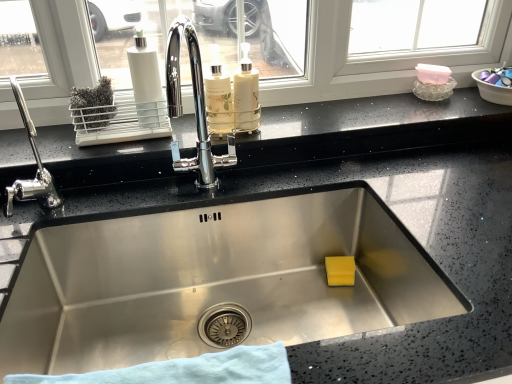
Locate an element on the screen. Image resolution: width=512 pixels, height=384 pixels. translucent glass bottle at center, arranged as the 1th bottle when viewed from the left is located at coordinates (218, 97).

Describe the element at coordinates (218, 97) in the screenshot. This screenshot has height=384, width=512. I see `translucent glass bottle at center, arranged as the 1th bottle when viewed from the left` at that location.

Identify the location of white matte bottle at center, positioned as the second bottle in left-to-right order. The image size is (512, 384). (246, 94).

Identify the location of blue cloth at bottom. pos(187,370).

Does white matte bottle at center, which is the 1th bottle from right to left, have a lesser height compared to translucent glass bottle at center, arranged as the 1th bottle when viewed from the left?

Incorrect, the height of white matte bottle at center, which is the 1th bottle from right to left, does not fall short of that of translucent glass bottle at center, arranged as the 1th bottle when viewed from the left.

Find the location of a particular element. The width and height of the screenshot is (512, 384). bottle lying on the left of white matte bottle at center, positioned as the second bottle in left-to-right order is located at coordinates (218, 97).

Is there a large distance between white matte bottle at center, positioned as the second bottle in left-to-right order, and translucent glass bottle at center, arranged as the 1th bottle when viewed from the left?

No.

Is chrome metallic faucet at left positioned far away from translucent glass bottle at center, arranged as the 1th bottle when viewed from the left?

No, chrome metallic faucet at left is not far away from translucent glass bottle at center, arranged as the 1th bottle when viewed from the left.

From a real-world perspective, is chrome metallic faucet at left over translucent glass bottle at center, arranged as the 1th bottle when viewed from the left?

No, from a real-world perspective, chrome metallic faucet at left is not on top of translucent glass bottle at center, arranged as the 1th bottle when viewed from the left.

Could you tell me if chrome metallic faucet at left is turned towards translucent glass bottle at center, positioned as the second bottle in right-to-left order?

No, chrome metallic faucet at left is not aimed at translucent glass bottle at center, positioned as the second bottle in right-to-left order.

Consider the image. Is chrome metallic faucet at left in front of or behind translucent glass bottle at center, positioned as the second bottle in right-to-left order, in the image?

chrome metallic faucet at left is positioned closer to the viewer than translucent glass bottle at center, positioned as the second bottle in right-to-left order.

Between translucent glass bottle at center, positioned as the second bottle in right-to-left order, and blue cloth at bottom, which one has smaller width?

With smaller width is translucent glass bottle at center, positioned as the second bottle in right-to-left order.

Between point (231, 120) and point (156, 363), which one is positioned behind?

Point (231, 120)

Where is `bath towel below the translucent glass bottle at center, positioned as the second bottle in right-to-left order (from a real-world perspective)`? bath towel below the translucent glass bottle at center, positioned as the second bottle in right-to-left order (from a real-world perspective) is located at coordinates (187, 370).

Is translucent glass bottle at center, arranged as the 1th bottle when viewed from the left, at the left side of blue cloth at bottom?

No.

Is chrome metallic faucet at left at the right side of white matte bottle at center, which is the 1th bottle from right to left?

No.

Looking at their sizes, would you say chrome metallic faucet at left is wider or thinner than white matte bottle at center, which is the 1th bottle from right to left?

Clearly, chrome metallic faucet at left has more width compared to white matte bottle at center, which is the 1th bottle from right to left.

Considering the sizes of objects chrome metallic faucet at left and white matte bottle at center, which is the 1th bottle from right to left, in the image provided, who is shorter, chrome metallic faucet at left or white matte bottle at center, which is the 1th bottle from right to left,?

With less height is white matte bottle at center, which is the 1th bottle from right to left.

From a real-world perspective, which is physically above, chrome metallic faucet at left or white matte bottle at center, which is the 1th bottle from right to left?

white matte bottle at center, which is the 1th bottle from right to left, is physically above.

In terms of width, does blue cloth at bottom look wider or thinner when compared to white matte bottle at center, which is the 1th bottle from right to left?

Considering their sizes, blue cloth at bottom looks broader than white matte bottle at center, which is the 1th bottle from right to left.

Does blue cloth at bottom have a greater height compared to white matte bottle at center, which is the 1th bottle from right to left?

No, blue cloth at bottom is not taller than white matte bottle at center, which is the 1th bottle from right to left.

From a real-world perspective, is blue cloth at bottom located beneath white matte bottle at center, which is the 1th bottle from right to left?

Correct, in the physical world, blue cloth at bottom is lower than white matte bottle at center, which is the 1th bottle from right to left.

How different are the orientations of blue cloth at bottom and white matte bottle at center, which is the 1th bottle from right to left, in degrees?

2.19 degrees.

Considering the relative positions of white matte bottle at center, which is the 1th bottle from right to left, and chrome metallic faucet at left in the image provided, is white matte bottle at center, which is the 1th bottle from right to left, behind chrome metallic faucet at left?

Yes, it is.

From the image's perspective, is white matte bottle at center, which is the 1th bottle from right to left, above chrome metallic faucet at left?

Correct, white matte bottle at center, which is the 1th bottle from right to left, appears higher than chrome metallic faucet at left in the image.

Find the location of a particular element. This screenshot has height=384, width=512. bottle that is the 2nd object to the right of the chrome metallic faucet at left, starting at the anchor is located at coordinates (246, 94).

From the picture: Is white matte bottle at center, positioned as the second bottle in left-to-right order, smaller than chrome metallic faucet at left?

Indeed, white matte bottle at center, positioned as the second bottle in left-to-right order, has a smaller size compared to chrome metallic faucet at left.

From a real-world perspective, which is physically above, blue cloth at bottom or translucent glass bottle at center, arranged as the 1th bottle when viewed from the left?

translucent glass bottle at center, arranged as the 1th bottle when viewed from the left, is physically above.

Find the location of `bath towel below the translucent glass bottle at center, arranged as the 1th bottle when viewed from the left (from a real-world perspective)`. bath towel below the translucent glass bottle at center, arranged as the 1th bottle when viewed from the left (from a real-world perspective) is located at coordinates (187, 370).

In terms of width, does blue cloth at bottom look wider or thinner when compared to translucent glass bottle at center, positioned as the second bottle in right-to-left order?

Clearly, blue cloth at bottom has more width compared to translucent glass bottle at center, positioned as the second bottle in right-to-left order.

You are a GUI agent. You are given a task and a screenshot of the screen. Output one action in this format:
    pyautogui.click(x=<x>, y=<y>)
    Task: Click on the bottle above the translucent glass bottle at center, arranged as the 1th bottle when viewed from the left (from the image's perspective)
    
    Given the screenshot: What is the action you would take?
    pyautogui.click(x=246, y=94)

At what (x,y) coordinates should I click in order to perform the action: click on tap located below the translucent glass bottle at center, arranged as the 1th bottle when viewed from the left (from the image's perspective). Please return your answer as a coordinate pair (x, y). This screenshot has width=512, height=384. Looking at the image, I should click on (37, 166).

Based on their spatial positions, is blue cloth at bottom or chrome metallic faucet at left further from white matte bottle at center, which is the 1th bottle from right to left?

Among the two, blue cloth at bottom is located further to white matte bottle at center, which is the 1th bottle from right to left.

Considering their positions, is translucent glass bottle at center, positioned as the second bottle in right-to-left order, positioned further to white matte bottle at center, which is the 1th bottle from right to left, than chrome metallic faucet at left?

Among the two, chrome metallic faucet at left is located further to white matte bottle at center, which is the 1th bottle from right to left.

Estimate the real-world distances between objects in this image. Which object is further from chrome metallic faucet at left, blue cloth at bottom or white matte bottle at center, positioned as the second bottle in left-to-right order?

white matte bottle at center, positioned as the second bottle in left-to-right order.

When comparing their distances from chrome metallic faucet at left, does blue cloth at bottom or translucent glass bottle at center, positioned as the second bottle in right-to-left order, seem further?

blue cloth at bottom lies further to chrome metallic faucet at left than the other object.

Which object lies nearer to the anchor point translucent glass bottle at center, positioned as the second bottle in right-to-left order, white matte bottle at center, positioned as the second bottle in left-to-right order, or blue cloth at bottom?

white matte bottle at center, positioned as the second bottle in left-to-right order, is positioned closer to the anchor translucent glass bottle at center, positioned as the second bottle in right-to-left order.

From the image, which object appears to be nearer to blue cloth at bottom, translucent glass bottle at center, arranged as the 1th bottle when viewed from the left, or white matte bottle at center, which is the 1th bottle from right to left?

Among the two, translucent glass bottle at center, arranged as the 1th bottle when viewed from the left, is located nearer to blue cloth at bottom.

From the image, which object appears to be farther from blue cloth at bottom, white matte bottle at center, which is the 1th bottle from right to left, or translucent glass bottle at center, arranged as the 1th bottle when viewed from the left?

Based on the image, white matte bottle at center, which is the 1th bottle from right to left, appears to be further to blue cloth at bottom.

From the image, which object appears to be farther from chrome metallic faucet at left, white matte bottle at center, positioned as the second bottle in left-to-right order, or translucent glass bottle at center, positioned as the second bottle in right-to-left order?

white matte bottle at center, positioned as the second bottle in left-to-right order, lies further to chrome metallic faucet at left than the other object.

What are the coordinates of `bottle between chrome metallic faucet at left and white matte bottle at center, which is the 1th bottle from right to left, from left to right` in the screenshot? It's located at (218, 97).

Where is `bottle between white matte bottle at center, which is the 1th bottle from right to left, and blue cloth at bottom vertically`? This screenshot has width=512, height=384. bottle between white matte bottle at center, which is the 1th bottle from right to left, and blue cloth at bottom vertically is located at coordinates (218, 97).

Find the location of a particular element. This screenshot has width=512, height=384. tap that lies between white matte bottle at center, positioned as the second bottle in left-to-right order, and blue cloth at bottom from top to bottom is located at coordinates (37, 166).

Locate an element on the screen. This screenshot has height=384, width=512. tap between translucent glass bottle at center, arranged as the 1th bottle when viewed from the left, and blue cloth at bottom vertically is located at coordinates (37, 166).